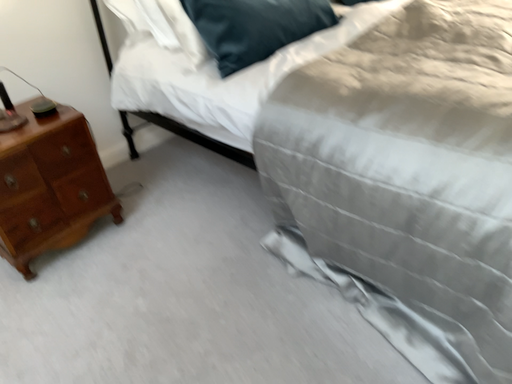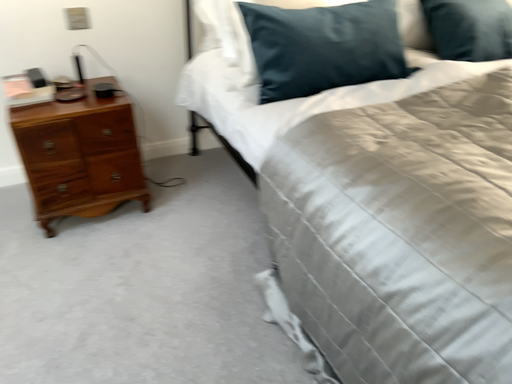
Question: How did the camera likely rotate when shooting the video?

Choices:
 (A) rotated right
 (B) rotated left

Answer: (B)